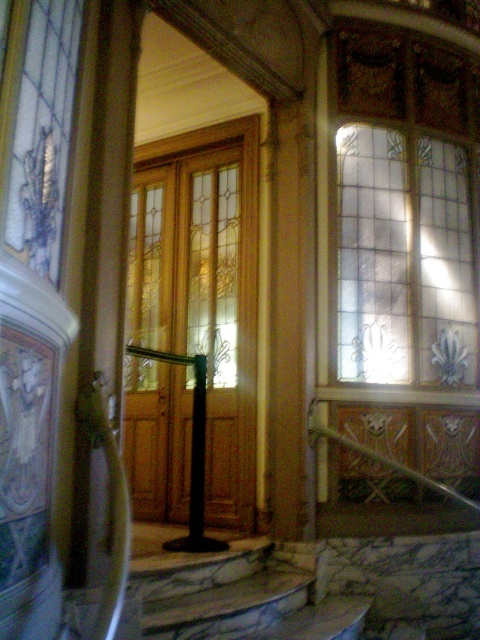
Which is more to the left, translucent wood door at center or marble stairs at lower center?

Positioned to the left is translucent wood door at center.

Between point (243, 224) and point (252, 604), which one is positioned in front?

Point (252, 604)

The height and width of the screenshot is (640, 480). What are the coordinates of `translucent wood door at center` in the screenshot? It's located at (204, 289).

Does stained glass at upper right have a greater width compared to marble stairs at lower center?

Incorrect, stained glass at upper right's width does not surpass marble stairs at lower center's.

What do you see at coordinates (405, 259) in the screenshot? This screenshot has width=480, height=640. I see `stained glass at upper right` at bounding box center [405, 259].

Does point (398, 310) come closer to viewer compared to point (244, 595)?

That is False.

Identify the location of stained glass at upper right. This screenshot has height=640, width=480. (405, 259).

Describe the element at coordinates (204, 289) in the screenshot. I see `translucent wood door at center` at that location.

Who is more distant from viewer, (219,518) or (372,288)?

The point (372,288) is more distant.

Which is behind, point (183, 262) or point (345, 289)?

The point (183, 262) is more distant.

This screenshot has width=480, height=640. What are the coordinates of `translucent wood door at center` in the screenshot? It's located at (204, 289).